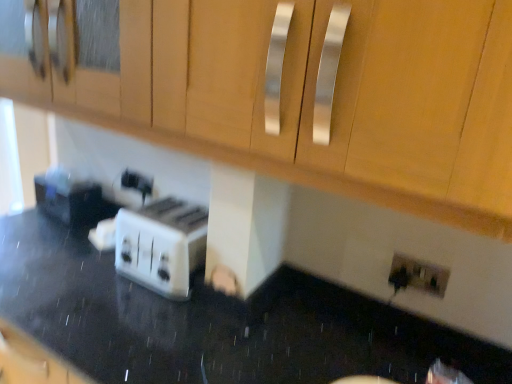
Locate an element on the screen. This screenshot has height=384, width=512. vacant area that is in front of white plastic toaster at center is located at coordinates (145, 322).